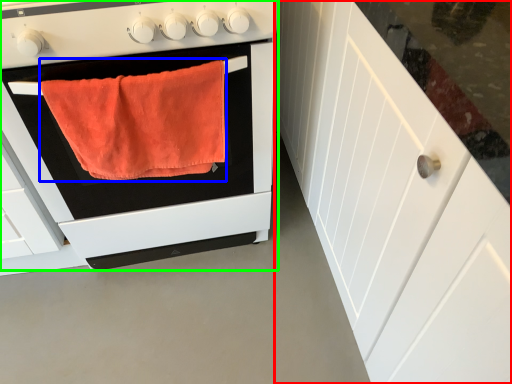
Question: Estimate the real-world distances between objects in this image. Which object is farther from cabinetry (highlighted by a red box), bath towel (highlighted by a blue box) or oven (highlighted by a green box)?

Choices:
 (A) bath towel
 (B) oven

Answer: (A)